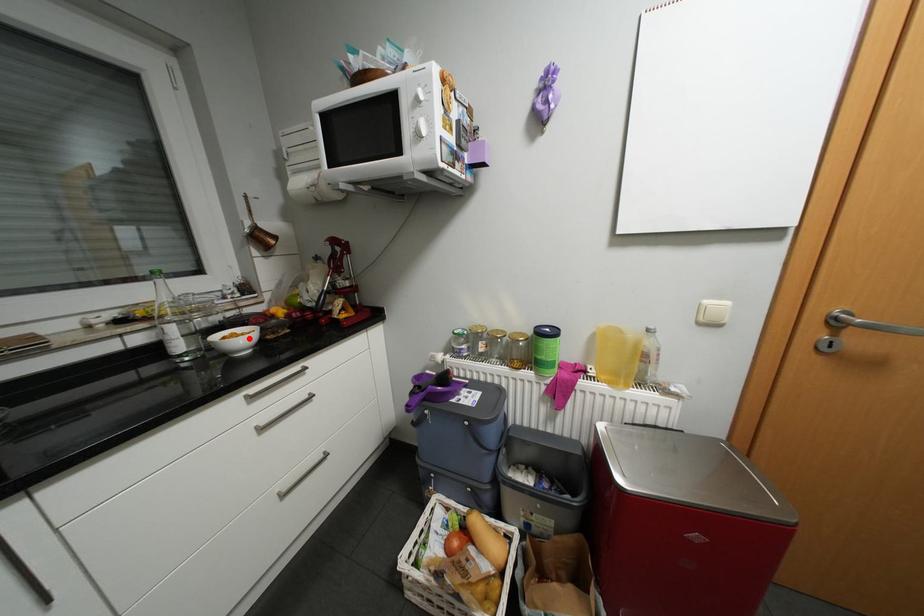
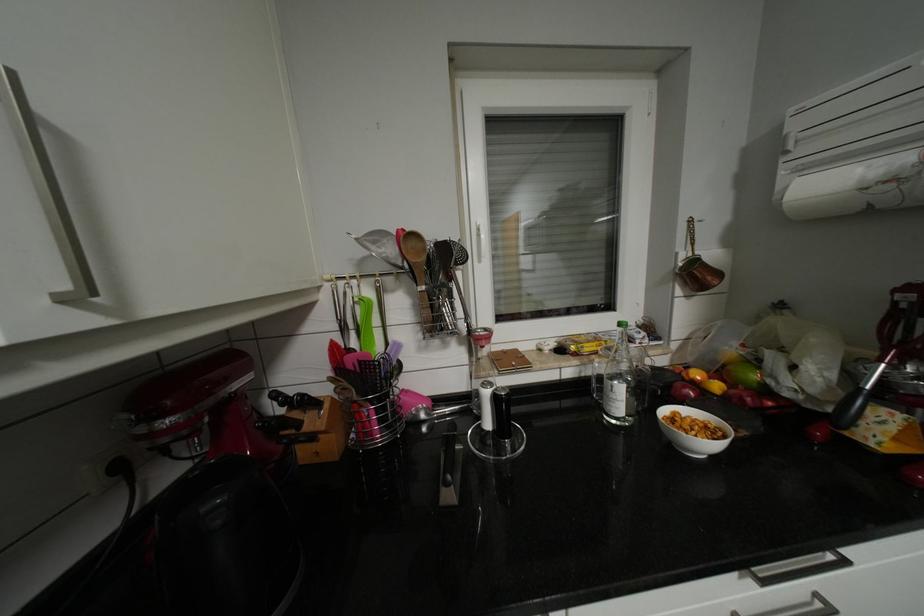
The point at the highlighted location is marked in the first image. Where is the corresponding point in the second image?

(703, 430)